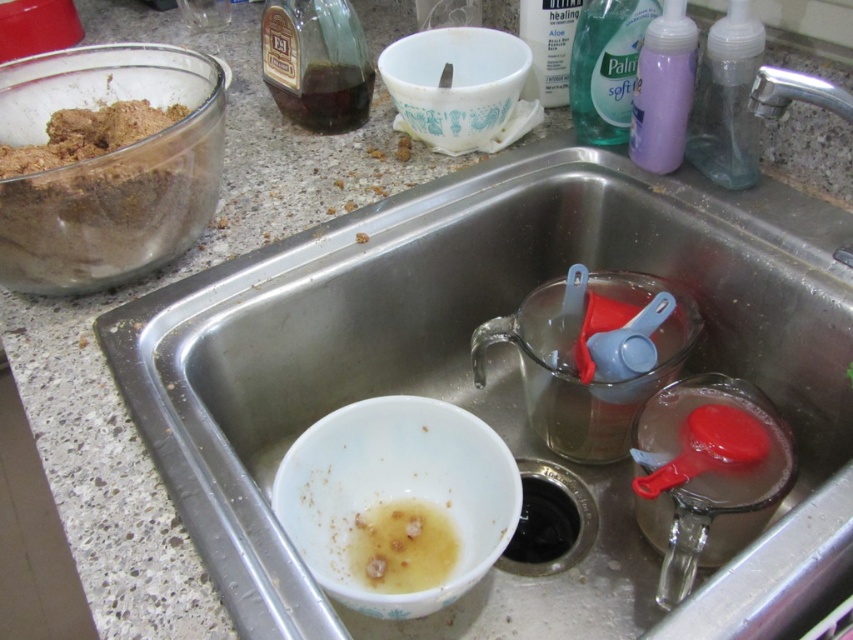
Question: In this image, where is white glossy bowl at sink bottom located relative to brown matte bowl at lower left?

Choices:
 (A) right
 (B) left

Answer: (B)

Question: Which object is positioned closest to the white ceramic bowl at upper center?

Choices:
 (A) dark amber liquid at upper center
 (B) brown matte bowl at lower left
 (C) white glossy bowl at sink bottom
 (D) white glossy bowl at lower left

Answer: (A)

Question: Considering the relative positions of white glossy bowl at sink bottom and dark amber liquid at upper center in the image provided, where is white glossy bowl at sink bottom located with respect to dark amber liquid at upper center?

Choices:
 (A) right
 (B) left

Answer: (A)

Question: Which point is closer to the camera?

Choices:
 (A) (757, 74)
 (B) (103, 230)
 (C) (163, 438)
 (D) (404, 518)

Answer: (C)

Question: Among these objects, which one is farthest from the camera?

Choices:
 (A) white ceramic bowl at upper center
 (B) translucent glass bowl at upper left

Answer: (A)

Question: Is dark amber liquid at upper center wider than silver metallic faucet at upper right?

Choices:
 (A) yes
 (B) no

Answer: (A)